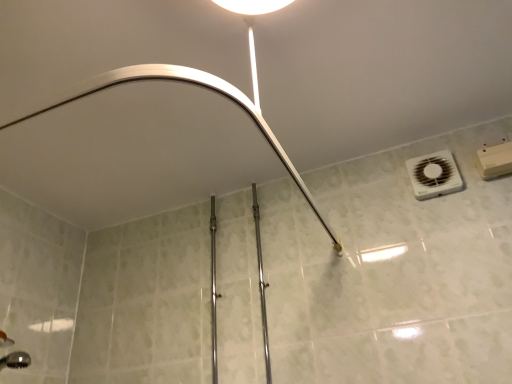
Question: Considering the relative positions of polished chrome rail at center and white plastic air conditioning at upper right in the image provided, is polished chrome rail at center to the right of white plastic air conditioning at upper right from the viewer's perspective?

Choices:
 (A) no
 (B) yes

Answer: (A)

Question: Is polished chrome rail at center with white plastic air conditioning at upper right?

Choices:
 (A) yes
 (B) no

Answer: (B)

Question: Can you confirm if polished chrome rail at center is thinner than white plastic air conditioning at upper right?

Choices:
 (A) yes
 (B) no

Answer: (B)

Question: From a real-world perspective, is polished chrome rail at center physically above white plastic air conditioning at upper right?

Choices:
 (A) yes
 (B) no

Answer: (B)

Question: Can you confirm if polished chrome rail at center is shorter than white plastic air conditioning at upper right?

Choices:
 (A) yes
 (B) no

Answer: (B)

Question: In terms of height, does matte white shower arm at upper center look taller or shorter compared to white plastic air conditioning at upper right?

Choices:
 (A) short
 (B) tall

Answer: (A)

Question: From the image's perspective, relative to white plastic air conditioning at upper right, is matte white shower arm at upper center above or below?

Choices:
 (A) above
 (B) below

Answer: (B)

Question: Considering the positions of point (169, 69) and point (445, 168), is point (169, 69) closer or farther from the camera than point (445, 168)?

Choices:
 (A) closer
 (B) farther

Answer: (A)

Question: In the image, is matte white shower arm at upper center positioned in front of or behind white plastic air conditioning at upper right?

Choices:
 (A) front
 (B) behind

Answer: (A)

Question: Considering the positions of white plastic air conditioning at upper right and matte white shower arm at upper center in the image, is white plastic air conditioning at upper right taller or shorter than matte white shower arm at upper center?

Choices:
 (A) tall
 (B) short

Answer: (A)

Question: Does point 449,175 appear closer or farther from the camera than point 326,228?

Choices:
 (A) closer
 (B) farther

Answer: (A)

Question: Is white plastic air conditioning at upper right situated inside matte white shower arm at upper center or outside?

Choices:
 (A) outside
 (B) inside

Answer: (A)

Question: From the image's perspective, is white plastic air conditioning at upper right above or below matte white shower arm at upper center?

Choices:
 (A) above
 (B) below

Answer: (A)

Question: Considering the positions of matte white shower arm at upper center and polished chrome rail at center in the image, is matte white shower arm at upper center wider or thinner than polished chrome rail at center?

Choices:
 (A) thin
 (B) wide

Answer: (B)

Question: Is point (258, 125) positioned closer to the camera than point (266, 339)?

Choices:
 (A) closer
 (B) farther

Answer: (A)